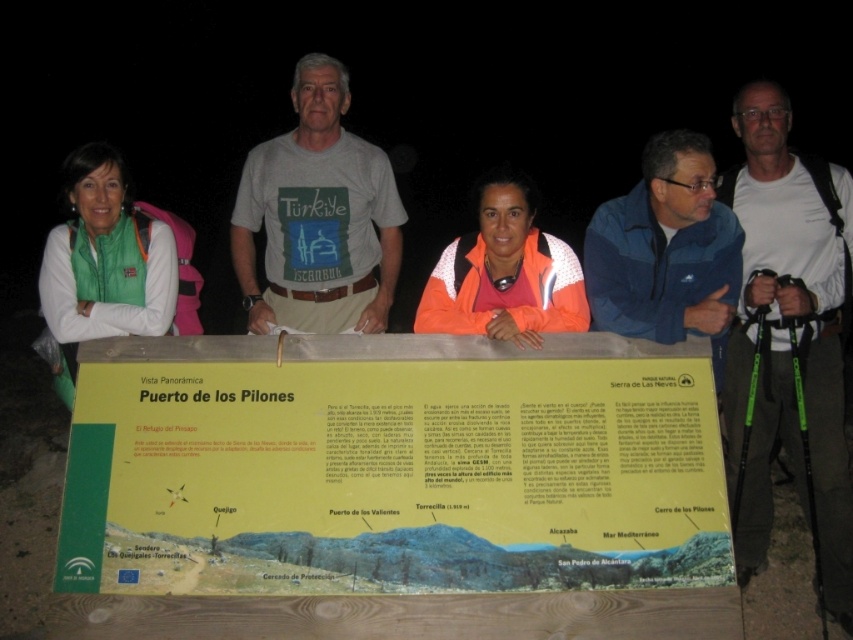
Does blue fabric jacket at upper right have a smaller size compared to orange fleece jacket at center?

Incorrect, blue fabric jacket at upper right is not smaller in size than orange fleece jacket at center.

Between blue fabric jacket at upper right and orange fleece jacket at center, which one has more height?

blue fabric jacket at upper right is taller.

At what (x,y) coordinates should I click in order to perform the action: click on blue fabric jacket at upper right. Please return your answer as a coordinate pair (x, y). The image size is (853, 640). Looking at the image, I should click on (666, 250).

Where is `blue fabric jacket at upper right`? Image resolution: width=853 pixels, height=640 pixels. blue fabric jacket at upper right is located at coordinates (666, 250).

In the scene shown: Is gray cotton t-shirt at center above green fleece jacket at left?

Indeed, gray cotton t-shirt at center is positioned over green fleece jacket at left.

Is point (300, 262) closer to viewer compared to point (59, 298)?

No, (300, 262) is behind (59, 298).

Where is `gray cotton t-shirt at center`? gray cotton t-shirt at center is located at coordinates (318, 216).

Can you confirm if yellow paper sign at center is positioned below blue fabric jacket at upper right?

Yes.

Does point (265, 442) come in front of point (596, 243)?

Yes, it is in front of point (596, 243).

Where is `yellow paper sign at center`? The width and height of the screenshot is (853, 640). yellow paper sign at center is located at coordinates (393, 476).